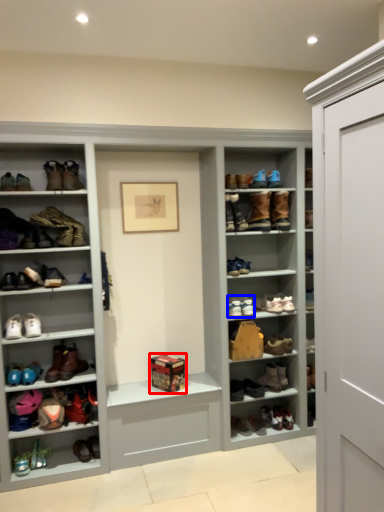
Question: Which point is closer to the camera, box (highlighted by a red box) or shoe (highlighted by a blue box)?

Choices:
 (A) box
 (B) shoe

Answer: (A)